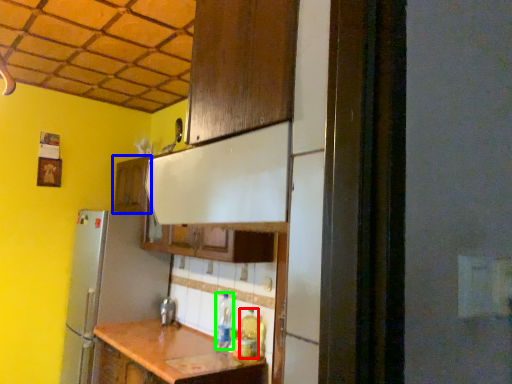
Question: Estimate the real-world distances between objects in this image. Which object is farther from bottle (highlighted by a red box), cabinetry (highlighted by a blue box) or bottle (highlighted by a green box)?

Choices:
 (A) cabinetry
 (B) bottle

Answer: (A)